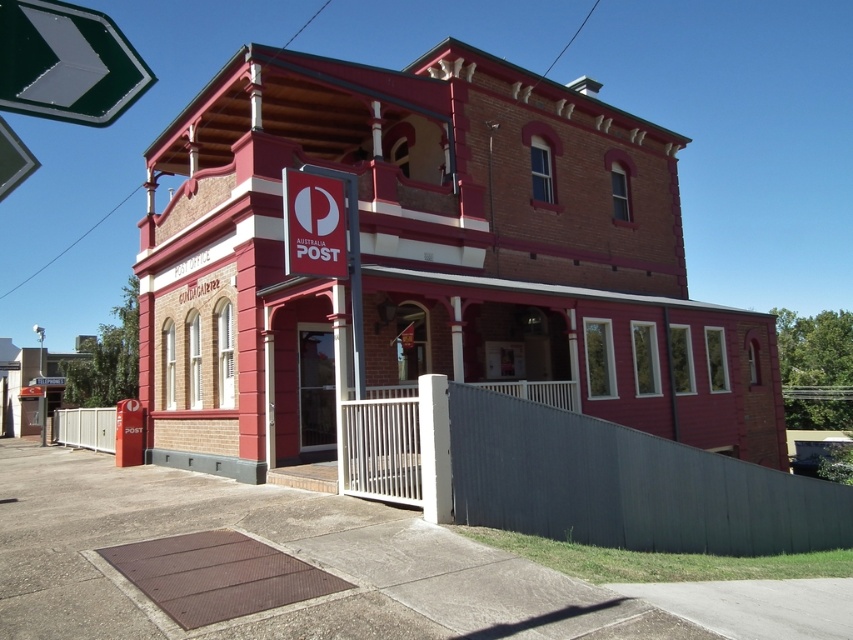
Identify the location of matte red sign at center. (314, 225).

Can you confirm if matte red sign at center is positioned to the right of white metal fence at lower left?

Indeed, matte red sign at center is positioned on the right side of white metal fence at lower left.

Who is more forward, (312, 275) or (102, 412)?

Point (312, 275)

This screenshot has height=640, width=853. I want to click on matte red sign at center, so click(x=314, y=225).

Can you confirm if metallic gray fence at center is smaller than white metal fence at lower left?

Actually, metallic gray fence at center might be larger than white metal fence at lower left.

Does metallic gray fence at center come in front of white metal fence at lower left?

That is True.

Which is behind, point (438, 452) or point (90, 412)?

Positioned behind is point (90, 412).

What are the coordinates of `metallic gray fence at center` in the screenshot? It's located at (577, 477).

Is metallic gray fence at center shorter than green reflective arrow at upper left?

Incorrect, metallic gray fence at center's height does not fall short of green reflective arrow at upper left's.

The width and height of the screenshot is (853, 640). Describe the element at coordinates (577, 477) in the screenshot. I see `metallic gray fence at center` at that location.

Locate an element on the screen. Image resolution: width=853 pixels, height=640 pixels. metallic gray fence at center is located at coordinates (577, 477).